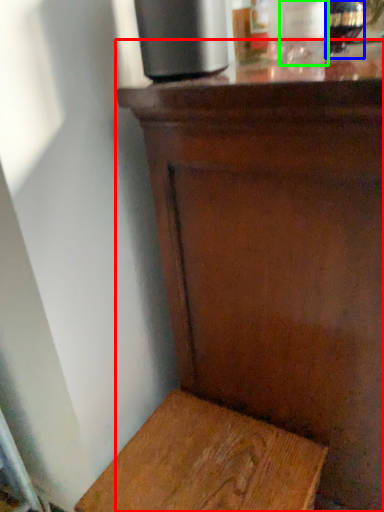
Question: Based on their relative distances, which object is nearer to table (highlighted by a red box)? Choose from bottle (highlighted by a blue box) and bottle (highlighted by a green box).

Choices:
 (A) bottle
 (B) bottle

Answer: (B)